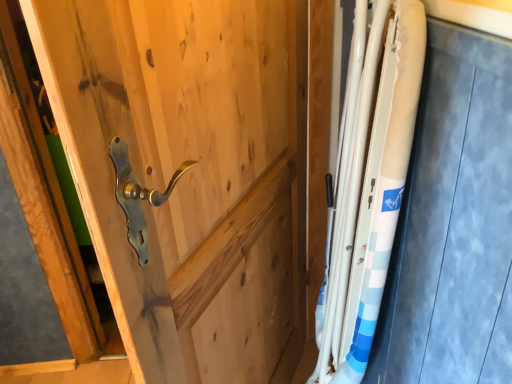
Identify the location of natural wood door handle at center. (196, 170).

Describe the element at coordinates (196, 170) in the screenshot. I see `natural wood door handle at center` at that location.

You are a GUI agent. You are given a task and a screenshot of the screen. Output one action in this format:
    pyautogui.click(x=<x>, y=<y>)
    Task: Click on the white glossy steel at right
    The height and width of the screenshot is (384, 512).
    Given the screenshot: What is the action you would take?
    pyautogui.click(x=368, y=185)

What do you see at coordinates (368, 185) in the screenshot?
I see `white glossy steel at right` at bounding box center [368, 185].

I want to click on natural wood door handle at center, so click(196, 170).

Which object is positioned more to the right, white glossy steel at right or natural wood door handle at center?

Positioned to the right is white glossy steel at right.

Between white glossy steel at right and natural wood door handle at center, which one is positioned in front?

natural wood door handle at center is more forward.

Is point (328, 323) positioned behind point (86, 168)?

Yes, it is behind point (86, 168).

Looking at this image, from the image's perspective, which is above, white glossy steel at right or natural wood door handle at center?

From the image's view, white glossy steel at right is above.

From a real-world perspective, which object stands above the other?

white glossy steel at right.

Considering the sizes of objects white glossy steel at right and natural wood door handle at center in the image provided, who is wider, white glossy steel at right or natural wood door handle at center?

white glossy steel at right.

Between white glossy steel at right and natural wood door handle at center, which one has more height?

Standing taller between the two is natural wood door handle at center.

Considering the relative sizes of white glossy steel at right and natural wood door handle at center in the image provided, is white glossy steel at right bigger than natural wood door handle at center?

Actually, white glossy steel at right might be smaller than natural wood door handle at center.

Is natural wood door handle at center a part of white glossy steel at right?

No, natural wood door handle at center is located outside of white glossy steel at right.

Consider the image. Is white glossy steel at right next to natural wood door handle at center?

white glossy steel at right and natural wood door handle at center are clearly separated.

From the picture: Is natural wood door handle at center at the back of white glossy steel at right?

Yes, white glossy steel at right is positioned with its back facing natural wood door handle at center.

What's the angular difference between white glossy steel at right and natural wood door handle at center's facing directions?

There is a 26.3-degree angle between the facing directions of white glossy steel at right and natural wood door handle at center.

The height and width of the screenshot is (384, 512). I want to click on door in front of the white glossy steel at right, so click(196, 170).

Would you say natural wood door handle at center is to the left or to the right of white glossy steel at right in the picture?

Based on their positions, natural wood door handle at center is located to the left of white glossy steel at right.

Is natural wood door handle at center in front of or behind white glossy steel at right in the image?

natural wood door handle at center is positioned closer to the viewer than white glossy steel at right.

Considering the positions of points (133, 262) and (362, 229), is point (133, 262) closer to camera compared to point (362, 229)?

Yes, point (133, 262) is in front of point (362, 229).

From the image's perspective, would you say natural wood door handle at center is shown under white glossy steel at right?

Yes, from the image's perspective, natural wood door handle at center is below white glossy steel at right.

From a real-world perspective, between natural wood door handle at center and white glossy steel at right, who is vertically higher?

white glossy steel at right, from a real-world perspective.

Which object is wider, natural wood door handle at center or white glossy steel at right?

With larger width is white glossy steel at right.

Considering the sizes of natural wood door handle at center and white glossy steel at right in the image, is natural wood door handle at center taller or shorter than white glossy steel at right?

Considering their sizes, natural wood door handle at center has more height than white glossy steel at right.

In the scene shown: Can you confirm if natural wood door handle at center is smaller than white glossy steel at right?

Actually, natural wood door handle at center might be larger than white glossy steel at right.

Choose the correct answer: Is natural wood door handle at center inside white glossy steel at right or outside it?

The correct answer is: outside.

Is natural wood door handle at center placed right next to white glossy steel at right?

No, natural wood door handle at center is not in contact with white glossy steel at right.

Is natural wood door handle at center oriented away from white glossy steel at right?

Yes.

How different are the orientations of natural wood door handle at center and white glossy steel at right in degrees?

They differ by 26.3 degrees in their facing directions.

The image size is (512, 384). Identify the location of door on the left of white glossy steel at right. (196, 170).

Find the location of `door below the white glossy steel at right (from a real-world perspective)`. door below the white glossy steel at right (from a real-world perspective) is located at coordinates (196, 170).

This screenshot has height=384, width=512. Identify the location of steel behind the natural wood door handle at center. (368, 185).